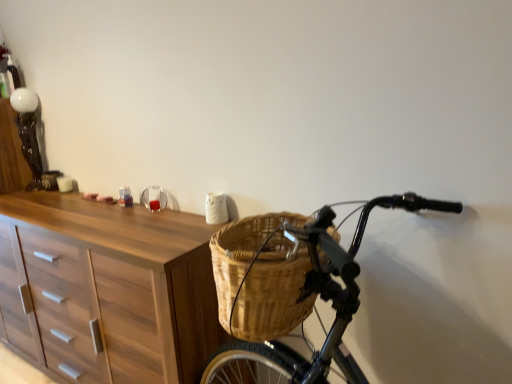
Where is `wooden chest of drawers at left`? Image resolution: width=512 pixels, height=384 pixels. wooden chest of drawers at left is located at coordinates (118, 287).

The height and width of the screenshot is (384, 512). What do you see at coordinates (118, 287) in the screenshot?
I see `wooden chest of drawers at left` at bounding box center [118, 287].

This screenshot has height=384, width=512. I want to click on wooden chest of drawers at left, so click(x=118, y=287).